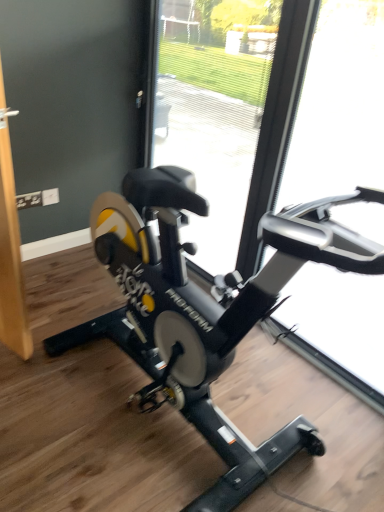
The image size is (384, 512). I want to click on free point above black matte stationary bicycle at center (from a real-world perspective), so click(135, 384).